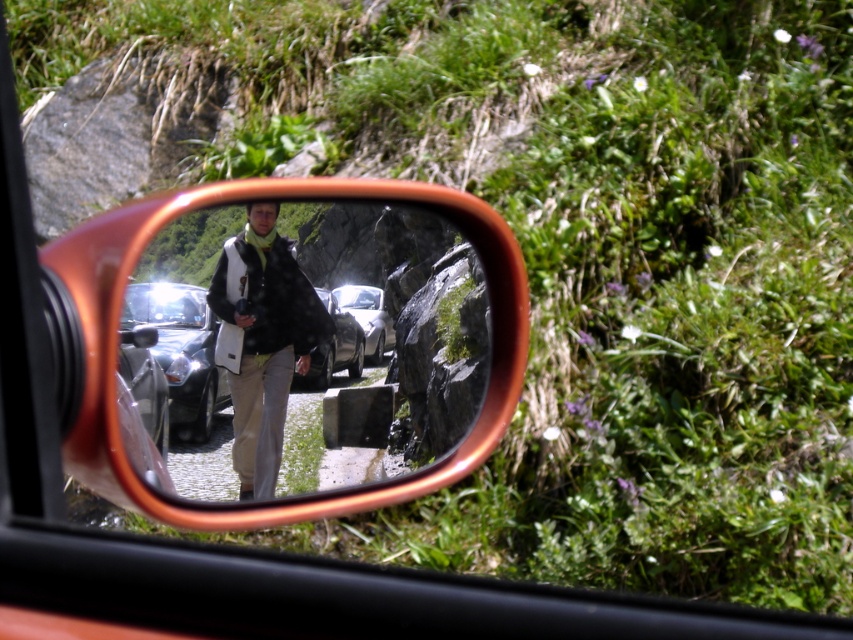
Question: Which of the following is the closest to the observer?

Choices:
 (A) shiny metallic car at center
 (B) metallic silver car at center
 (C) matte black jacket at center
 (D) shiny silver car at center

Answer: (C)

Question: Which object appears farthest from the camera in this image?

Choices:
 (A) matte black jacket at center
 (B) shiny silver car at center

Answer: (B)

Question: Based on their relative distances, which object is farther from the shiny metallic car at center?

Choices:
 (A) metallic silver car at center
 (B) shiny silver car at center

Answer: (A)

Question: Is shiny metallic mirror at center positioned in front of metallic silver car at center?

Choices:
 (A) yes
 (B) no

Answer: (A)

Question: Can you confirm if shiny metallic mirror at center is positioned to the left of metallic silver car at center?

Choices:
 (A) no
 (B) yes

Answer: (B)

Question: Is the position of shiny metallic mirror at center less distant than that of shiny metallic car at center?

Choices:
 (A) no
 (B) yes

Answer: (B)